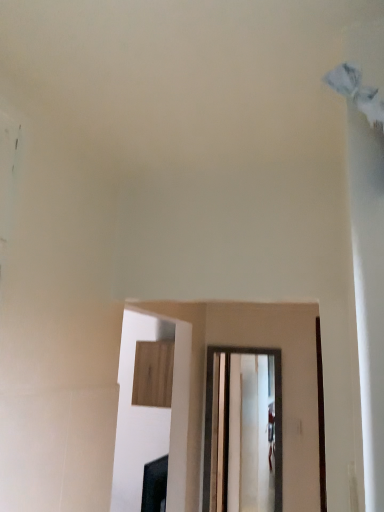
Question: Is wooden cabinet at upper center next to clear glass door at center and touching it?

Choices:
 (A) yes
 (B) no

Answer: (B)

Question: Is wooden cabinet at upper center at the right side of clear glass door at center?

Choices:
 (A) no
 (B) yes

Answer: (A)

Question: Does wooden cabinet at upper center come behind clear glass door at center?

Choices:
 (A) no
 (B) yes

Answer: (B)

Question: From the image's perspective, is wooden cabinet at upper center above clear glass door at center?

Choices:
 (A) yes
 (B) no

Answer: (A)

Question: Is wooden cabinet at upper center thinner than clear glass door at center?

Choices:
 (A) no
 (B) yes

Answer: (A)

Question: Is wooden cabinet at upper center not near clear glass door at center?

Choices:
 (A) yes
 (B) no

Answer: (B)

Question: From a real-world perspective, is clear glass door at center located beneath wooden cabinet at upper center?

Choices:
 (A) no
 (B) yes

Answer: (B)

Question: Is clear glass door at center facing towards wooden cabinet at upper center?

Choices:
 (A) no
 (B) yes

Answer: (A)

Question: Does clear glass door at center have a greater width compared to wooden cabinet at upper center?

Choices:
 (A) no
 (B) yes

Answer: (A)

Question: Is clear glass door at center positioned before wooden cabinet at upper center?

Choices:
 (A) no
 (B) yes

Answer: (B)

Question: Is clear glass door at center outside wooden cabinet at upper center?

Choices:
 (A) no
 (B) yes

Answer: (B)

Question: Is clear glass door at center further to camera compared to wooden cabinet at upper center?

Choices:
 (A) yes
 (B) no

Answer: (B)

Question: Considering the positions of clear glass door at center and wooden cabinet at upper center in the image, is clear glass door at center bigger or smaller than wooden cabinet at upper center?

Choices:
 (A) small
 (B) big

Answer: (A)